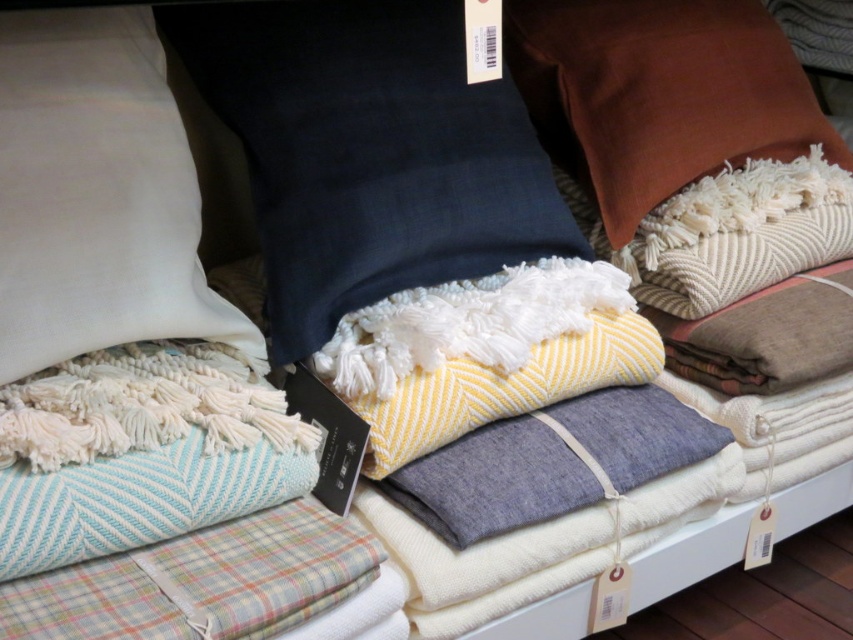
Does navy blue linen pillow at upper center appear over brown velvet pillow at upper right?

No.

Based on the photo, can you confirm if navy blue linen pillow at upper center is thinner than brown velvet pillow at upper right?

Yes.

Which is in front, point (387, 268) or point (637, 176)?

Positioned in front is point (387, 268).

Where is `navy blue linen pillow at upper center`? Image resolution: width=853 pixels, height=640 pixels. navy blue linen pillow at upper center is located at coordinates (368, 152).

Can you confirm if navy blue linen pillow at upper center is smaller than white cotton pillow at upper left?

No, navy blue linen pillow at upper center is not smaller than white cotton pillow at upper left.

Between point (276, 141) and point (173, 102), which one is positioned behind?

The point (276, 141) is behind.

Find the location of `navy blue linen pillow at upper center`. navy blue linen pillow at upper center is located at coordinates (368, 152).

Looking at this image, does white cotton pillow at upper left have a lesser height compared to brown velvet pillow at upper right?

Yes, white cotton pillow at upper left is shorter than brown velvet pillow at upper right.

Between point (18, 330) and point (645, 77), which one is positioned in front?

Point (18, 330) is more forward.

Which is behind, point (54, 77) or point (527, 38)?

Positioned behind is point (527, 38).

Find the location of `white cotton pillow at upper left`. white cotton pillow at upper left is located at coordinates (96, 195).